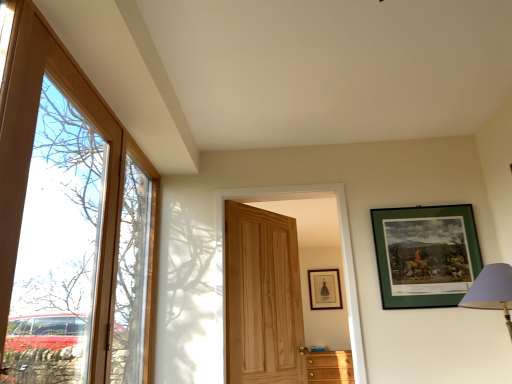
Image resolution: width=512 pixels, height=384 pixels. What do you see at coordinates (69, 225) in the screenshot? I see `wooden door at left, arranged as the second door when viewed from the back` at bounding box center [69, 225].

What do you see at coordinates (324, 289) in the screenshot? The image size is (512, 384). I see `matte black picture frame at upper center, which ranks as the first picture frame in bottom-to-top order` at bounding box center [324, 289].

The height and width of the screenshot is (384, 512). Find the location of `green matte picture frame at upper right, marked as the 2th picture frame in a back-to-front arrangement`. green matte picture frame at upper right, marked as the 2th picture frame in a back-to-front arrangement is located at coordinates (425, 253).

From the image's perspective, does wooden cabinet at lower right appear lower than clear glass window at left?

Correct, wooden cabinet at lower right appears lower than clear glass window at left in the image.

Does wooden cabinet at lower right appear on the left side of clear glass window at left?

In fact, wooden cabinet at lower right is to the right of clear glass window at left.

From a real-world perspective, which object stands above the other?

From a 3D spatial view, clear glass window at left is above.

Considering the sizes of objects wooden door at left, which ranks as the second door in right-to-left order, and green matte picture frame at upper right, marked as the 2th picture frame in a back-to-front arrangement, in the image provided, who is taller, wooden door at left, which ranks as the second door in right-to-left order, or green matte picture frame at upper right, marked as the 2th picture frame in a back-to-front arrangement,?

With more height is wooden door at left, which ranks as the second door in right-to-left order.

From a real-world perspective, is wooden door at left, arranged as the second door when viewed from the back, on top of green matte picture frame at upper right, marked as the 2th picture frame in a back-to-front arrangement?

Incorrect, from a real-world perspective, wooden door at left, arranged as the second door when viewed from the back, is lower than green matte picture frame at upper right, marked as the 2th picture frame in a back-to-front arrangement.

Which is correct: wooden door at left, the 1th door from the front, is inside green matte picture frame at upper right, which appears as the 1th picture frame when viewed from the top, or outside of it?

wooden door at left, the 1th door from the front, lies outside green matte picture frame at upper right, which appears as the 1th picture frame when viewed from the top.

Between matte black picture frame at upper center, the second picture frame positioned from the top, and wooden door at left, arranged as the second door when viewed from the back, which one has less height?

matte black picture frame at upper center, the second picture frame positioned from the top.

Which is more to the right, matte black picture frame at upper center, which is the first picture frame from back to front, or wooden door at left, which ranks as the second door in right-to-left order?

matte black picture frame at upper center, which is the first picture frame from back to front.

From the image's perspective, count 2nd picture frames downward from the wooden door at left, arranged as the second door when viewed from the back, and point to it. Please provide its 2D coordinates.

[(324, 289)]

Which object is wider, matte black picture frame at upper center, which is the first picture frame from back to front, or wooden door at left, arranged as the second door when viewed from the back?

wooden door at left, arranged as the second door when viewed from the back, is wider.

Considering the relative sizes of clear glass window at left and wooden cabinet at lower right in the image provided, is clear glass window at left taller than wooden cabinet at lower right?

Yes, clear glass window at left is taller than wooden cabinet at lower right.

From a real-world perspective, which is physically below, clear glass window at left or wooden cabinet at lower right?

From a 3D spatial view, wooden cabinet at lower right is below.

You are a GUI agent. You are given a task and a screenshot of the screen. Output one action in this format:
    pyautogui.click(x=<x>, y=<y>)
    Task: Click on the cabinetry below the clear glass window at left (from a real-world perspective)
    
    Given the screenshot: What is the action you would take?
    pyautogui.click(x=330, y=367)

From the picture: Would you say clear glass window at left is outside wooden cabinet at lower right?

Yes, clear glass window at left is outside of wooden cabinet at lower right.

Do you think natural wood door at center, acting as the 1th door starting from the right, is within clear glass window at left, or outside of it?

natural wood door at center, acting as the 1th door starting from the right, is spatially situated outside clear glass window at left.

Between natural wood door at center, the 2th door positioned from the front, and clear glass window at left, which one has larger size?

Bigger between the two is natural wood door at center, the 2th door positioned from the front.

In the image, there is a clear glass window at left. Identify the location of door below it (from the image's perspective). [x=262, y=297].

Does point (273, 363) come closer to viewer compared to point (120, 338)?

No, it is not.

Which object is further away from the camera taking this photo, natural wood door at center, the 2th door positioned from the front, or wooden cabinet at lower right?

Positioned behind is wooden cabinet at lower right.

Would you say wooden cabinet at lower right is part of natural wood door at center, the 2th door positioned from the front,'s contents?

No, wooden cabinet at lower right is not inside natural wood door at center, the 2th door positioned from the front.

Is natural wood door at center, acting as the 1th door starting from the right, to the right of wooden cabinet at lower right from the viewer's perspective?

No.

Identify the location of door above the natural wood door at center, acting as the 1th door starting from the right (from the image's perspective). point(69,225).

In the scene shown: Between natural wood door at center, the 2th door positioned from the front, and wooden door at left, which ranks as the second door in right-to-left order, which one has smaller size?

With smaller size is natural wood door at center, the 2th door positioned from the front.

Does natural wood door at center, which is the 2th door from left to right, have a lesser height compared to wooden door at left, the 1th door from the front?

No, natural wood door at center, which is the 2th door from left to right, is not shorter than wooden door at left, the 1th door from the front.

Find the location of a particular element. The width and height of the screenshot is (512, 384). cabinetry behind the clear glass window at left is located at coordinates (330, 367).

Locate an element on the screen. Image resolution: width=512 pixels, height=384 pixels. door that is the 2nd object to the left of the green matte picture frame at upper right, which ranks as the second picture frame in bottom-to-top order, starting at the anchor is located at coordinates (69, 225).

When comparing their distances from matte black picture frame at upper center, which is the first picture frame from back to front, does wooden cabinet at lower right or wooden door at left, the first door viewed from the left, seem closer?

Among the two, wooden cabinet at lower right is located nearer to matte black picture frame at upper center, which is the first picture frame from back to front.

From the image, which object appears to be nearer to clear glass window at left, natural wood door at center, acting as the 1th door starting from the right, or green matte picture frame at upper right, which ranks as the second picture frame in bottom-to-top order?

natural wood door at center, acting as the 1th door starting from the right, lies closer to clear glass window at left than the other object.

When comparing their distances from matte black picture frame at upper center, the second picture frame positioned from the top, does green matte picture frame at upper right, arranged as the 1th picture frame when viewed from the front, or wooden cabinet at lower right seem further?

green matte picture frame at upper right, arranged as the 1th picture frame when viewed from the front.

From the image, which object appears to be farther from green matte picture frame at upper right, which ranks as the second picture frame in bottom-to-top order, matte black picture frame at upper center, which ranks as the first picture frame in bottom-to-top order, or wooden door at left, arranged as the second door when viewed from the back?

matte black picture frame at upper center, which ranks as the first picture frame in bottom-to-top order, is further to green matte picture frame at upper right, which ranks as the second picture frame in bottom-to-top order.

Considering their positions, is wooden door at left, the 1th door from the front, positioned closer to matte black picture frame at upper center, which appears as the 2th picture frame when viewed from the front, than clear glass window at left?

clear glass window at left.

Estimate the real-world distances between objects in this image. Which object is further from matte black picture frame at upper center, which appears as the 2th picture frame when viewed from the front, green matte picture frame at upper right, marked as the 2th picture frame in a back-to-front arrangement, or wooden door at left, the first door viewed from the left?

Among the two, wooden door at left, the first door viewed from the left, is located further to matte black picture frame at upper center, which appears as the 2th picture frame when viewed from the front.

When comparing their distances from natural wood door at center, the 1th door from the back, does clear glass window at left or green matte picture frame at upper right, arranged as the 1th picture frame when viewed from the front, seem further?

green matte picture frame at upper right, arranged as the 1th picture frame when viewed from the front, lies further to natural wood door at center, the 1th door from the back, than the other object.

Estimate the real-world distances between objects in this image. Which object is further from matte black picture frame at upper center, which is the first picture frame from back to front, natural wood door at center, the 2th door positioned from the front, or green matte picture frame at upper right, arranged as the 1th picture frame when viewed from the front?

green matte picture frame at upper right, arranged as the 1th picture frame when viewed from the front, is positioned further to the anchor matte black picture frame at upper center, which is the first picture frame from back to front.

You are a GUI agent. You are given a task and a screenshot of the screen. Output one action in this format:
    pyautogui.click(x=<x>, y=<y>)
    Task: Click on the picture frame between clear glass window at left and matte black picture frame at upper center, the second picture frame positioned from the top, from front to back
    The width and height of the screenshot is (512, 384).
    Given the screenshot: What is the action you would take?
    pyautogui.click(x=425, y=253)

Locate an element on the screen. Image resolution: width=512 pixels, height=384 pixels. door located between clear glass window at left and wooden cabinet at lower right in the depth direction is located at coordinates (262, 297).

Find the location of a particular element. The image size is (512, 384). picture frame between natural wood door at center, which is the 2th door from left to right, and matte black picture frame at upper center, which appears as the 2th picture frame when viewed from the front, from front to back is located at coordinates (425, 253).

Where is `door between clear glass window at left and matte black picture frame at upper center, which appears as the 2th picture frame when viewed from the front, along the z-axis`? Image resolution: width=512 pixels, height=384 pixels. door between clear glass window at left and matte black picture frame at upper center, which appears as the 2th picture frame when viewed from the front, along the z-axis is located at coordinates (262, 297).